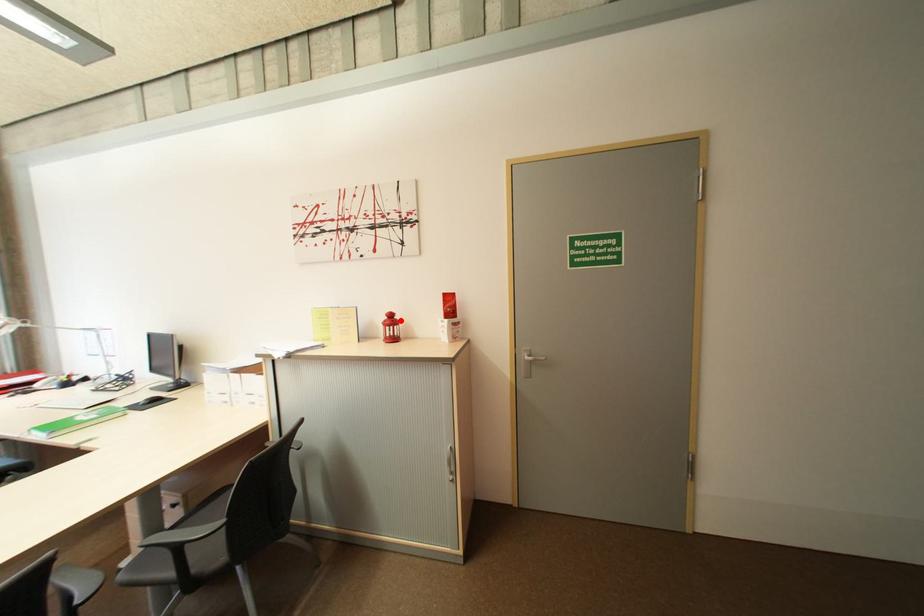
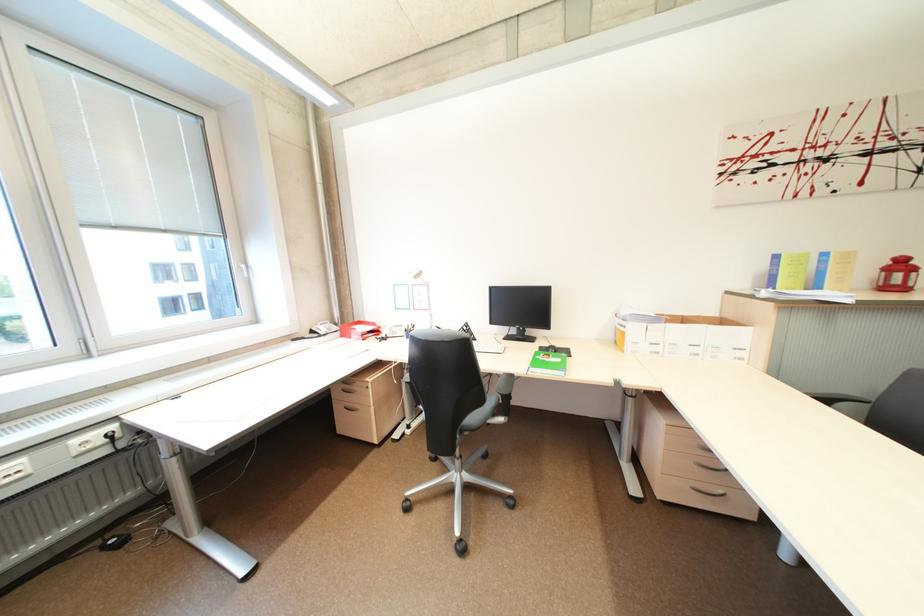
Where in the second image is the point corresponding to the highlighted location from the first image?

(910, 265)